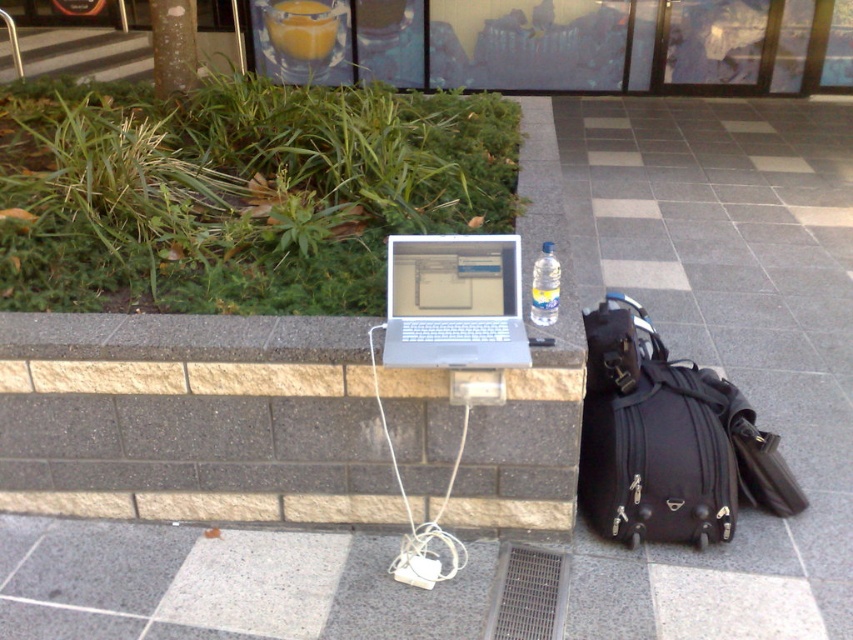
Is gray concrete stairs at upper left bigger than clear plastic bottle at center?

Indeed, gray concrete stairs at upper left has a larger size compared to clear plastic bottle at center.

How far apart are gray concrete stairs at upper left and clear plastic bottle at center?

A distance of 7.05 meters exists between gray concrete stairs at upper left and clear plastic bottle at center.

Who is more distant from viewer, (80, 38) or (544, 317)?

The point (80, 38) is behind.

At what (x,y) coordinates should I click in order to perform the action: click on gray concrete stairs at upper left. Please return your answer as a coordinate pair (x, y). Looking at the image, I should click on (85, 52).

Looking at this image, can you confirm if black fabric backpack at lower right is positioned below silver metallic laptop at center?

Indeed, black fabric backpack at lower right is positioned under silver metallic laptop at center.

Is point (631, 522) less distant than point (457, 321)?

No, it is not.

Locate an element on the screen. black fabric backpack at lower right is located at coordinates (659, 460).

Who is shorter, smooth gray pavement at right or clear plastic bottle at center?

With less height is clear plastic bottle at center.

Does smooth gray pavement at right appear under clear plastic bottle at center?

No.

You are a GUI agent. You are given a task and a screenshot of the screen. Output one action in this format:
    pyautogui.click(x=<x>, y=<y>)
    Task: Click on the smooth gray pavement at right
    The image size is (853, 640).
    Given the screenshot: What is the action you would take?
    pyautogui.click(x=726, y=339)